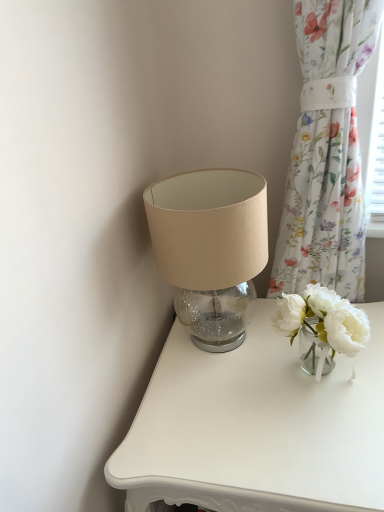
Where is `white matte vase at right`? Image resolution: width=384 pixels, height=512 pixels. white matte vase at right is located at coordinates (324, 319).

This screenshot has width=384, height=512. Describe the element at coordinates (324, 319) in the screenshot. I see `white matte vase at right` at that location.

Measure the distance between point (341, 95) and camera.

Point (341, 95) and camera are 35.35 inches apart.

The width and height of the screenshot is (384, 512). Describe the element at coordinates (327, 153) in the screenshot. I see `floral fabric curtain at right` at that location.

The width and height of the screenshot is (384, 512). Find the location of `floral fabric curtain at right`. floral fabric curtain at right is located at coordinates click(x=327, y=153).

At what (x,y) coordinates should I click in order to perform the action: click on white matte vase at right. Please return your answer as a coordinate pair (x, y). Looking at the image, I should click on (324, 319).

Between white matte vase at right and floral fabric curtain at right, which one appears on the right side from the viewer's perspective?

floral fabric curtain at right is more to the right.

Who is more distant, white matte vase at right or floral fabric curtain at right?

white matte vase at right.

Which is in front, point (339, 303) or point (275, 291)?

Positioned in front is point (339, 303).

From the image's perspective, is white matte vase at right above or below floral fabric curtain at right?

white matte vase at right is below floral fabric curtain at right.

From a real-world perspective, who is located lower, white matte vase at right or floral fabric curtain at right?

white matte vase at right, from a real-world perspective.

Between white matte vase at right and floral fabric curtain at right, which one has smaller width?

Thinner between the two is floral fabric curtain at right.

From the picture: From their relative heights in the image, would you say white matte vase at right is taller or shorter than floral fabric curtain at right?

Clearly, white matte vase at right is shorter compared to floral fabric curtain at right.

Based on their sizes in the image, would you say white matte vase at right is bigger or smaller than floral fabric curtain at right?

Considering their sizes, white matte vase at right takes up less space than floral fabric curtain at right.

Would you say white matte vase at right contains floral fabric curtain at right?

No, floral fabric curtain at right is not a part of white matte vase at right.

Is the surface of white matte vase at right in direct contact with floral fabric curtain at right?

No, white matte vase at right is not making contact with floral fabric curtain at right.

Is white matte vase at right facing away from floral fabric curtain at right?

No.

How different are the orientations of white matte vase at right and floral fabric curtain at right in degrees?

They differ by 91.4 degrees in their facing directions.

This screenshot has height=512, width=384. What are the coordinates of `curtain that is in front of the white matte vase at right` in the screenshot? It's located at point(327,153).

Considering the relative positions of floral fabric curtain at right and white matte vase at right in the image provided, is floral fabric curtain at right to the left or to the right of white matte vase at right?

In the image, floral fabric curtain at right appears on the right side of white matte vase at right.

Between floral fabric curtain at right and white matte vase at right, which one is positioned behind?

Positioned behind is white matte vase at right.

Considering the positions of point (321, 114) and point (305, 321), is point (321, 114) closer or farther from the camera than point (305, 321)?

Clearly, point (321, 114) is more distant from the camera than point (305, 321).

From the image's perspective, between floral fabric curtain at right and white matte vase at right, who is located below?

white matte vase at right.

Consider the image. From a real-world perspective, which is physically above, floral fabric curtain at right or white matte vase at right?

floral fabric curtain at right, from a real-world perspective.

Considering the sizes of objects floral fabric curtain at right and white matte vase at right in the image provided, who is wider, floral fabric curtain at right or white matte vase at right?

white matte vase at right.

From their relative heights in the image, would you say floral fabric curtain at right is taller or shorter than white matte vase at right?

floral fabric curtain at right is taller than white matte vase at right.

Considering the relative sizes of floral fabric curtain at right and white matte vase at right in the image provided, is floral fabric curtain at right bigger than white matte vase at right?

Correct, floral fabric curtain at right is larger in size than white matte vase at right.

Can white matte vase at right be found inside floral fabric curtain at right?

No, floral fabric curtain at right does not contain white matte vase at right.

Does floral fabric curtain at right touch white matte vase at right?

They are not placed beside each other.

Could you tell me if floral fabric curtain at right is turned towards white matte vase at right?

Yes.

Identify the location of curtain in front of the white matte vase at right. (327, 153).

Find the location of a particular element. flower below the floral fabric curtain at right (from a real-world perspective) is located at coordinates (324, 319).

Locate an element on the screen. The image size is (384, 512). flower behind the floral fabric curtain at right is located at coordinates (324, 319).